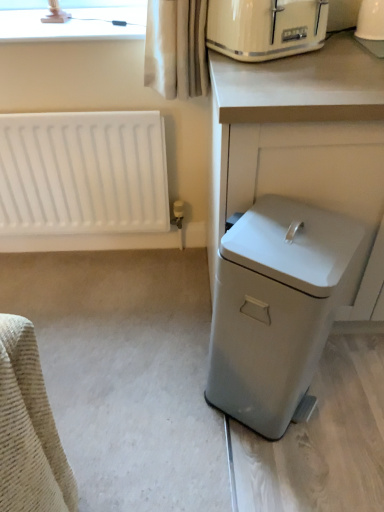
What do you see at coordinates (275, 308) in the screenshot? The height and width of the screenshot is (512, 384). I see `white matte trash can at lower right` at bounding box center [275, 308].

What are the coordinates of `white matte radiator at left` in the screenshot? It's located at (82, 181).

Locate an element on the screen. This screenshot has height=512, width=384. white plastic trash can at right is located at coordinates (303, 142).

You are a GUI agent. You are given a task and a screenshot of the screen. Output one action in this format:
    pyautogui.click(x=<x>, y=<y>)
    Task: Click on the white matte trash can at lower right
    
    Given the screenshot: What is the action you would take?
    pyautogui.click(x=275, y=308)

This screenshot has width=384, height=512. I want to click on dish washer in front of the matte cream toaster at upper right, so (275, 308).

Who is taller, matte cream toaster at upper right or white matte trash can at lower right?

white matte trash can at lower right.

Does matte cream toaster at upper right have a larger size compared to white matte trash can at lower right?

Actually, matte cream toaster at upper right might be smaller than white matte trash can at lower right.

What's the angular difference between white matte trash can at lower right and matte white lampshade at upper left's facing directions?

They differ by 30.1 degrees in their facing directions.

Which of these two, white matte trash can at lower right or matte white lampshade at upper left, is wider?

Wider between the two is matte white lampshade at upper left.

Is white matte trash can at lower right behind matte white lampshade at upper left?

No, white matte trash can at lower right is in front of matte white lampshade at upper left.

Find the location of `bay window that is behind the white matte trash can at lower right`. bay window that is behind the white matte trash can at lower right is located at coordinates (73, 20).

Does point (256, 293) appear closer or farther from the camera than point (294, 17)?

Clearly, point (256, 293) is closer to the camera than point (294, 17).

Identify the location of dish washer below the matte cream toaster at upper right (from a real-world perspective). The width and height of the screenshot is (384, 512). (275, 308).

Are white matte trash can at lower right and matte cream toaster at upper right making contact?

No, white matte trash can at lower right is not with matte cream toaster at upper right.

From a real-world perspective, between white matte trash can at lower right and matte cream toaster at upper right, who is vertically higher?

matte cream toaster at upper right, from a real-world perspective.

Which of these two, white plastic trash can at right or matte white lampshade at upper left, is smaller?

matte white lampshade at upper left.

Identify the location of counter on the right of matte white lampshade at upper left. This screenshot has height=512, width=384. (303, 142).

Can you see white plastic trash can at right touching matte white lampshade at upper left?

white plastic trash can at right and matte white lampshade at upper left are not in contact.

Between white plastic trash can at right and matte white lampshade at upper left, which one has larger width?

white plastic trash can at right is wider.

Is white glossy coffee maker at upper right facing towards white plastic trash can at right?

No, white glossy coffee maker at upper right does not turn towards white plastic trash can at right.

From a real-world perspective, which object stands above the other?

white glossy coffee maker at upper right is physically above.

From the image's perspective, which is below, white glossy coffee maker at upper right or white plastic trash can at right?

white plastic trash can at right, from the image's perspective.

From a real-world perspective, which object stands above the other?

white glossy coffee maker at upper right.

Which of these two, white matte trash can at lower right or white glossy coffee maker at upper right, is bigger?

With larger size is white matte trash can at lower right.

In the scene shown: From the image's perspective, which one is positioned lower, white matte trash can at lower right or white glossy coffee maker at upper right?

white matte trash can at lower right, from the image's perspective.

Find the location of a particular element. bay window above the matte cream toaster at upper right (from the image's perspective) is located at coordinates (73, 20).

Is matte cream toaster at upper right far away from matte white lampshade at upper left?

No, matte cream toaster at upper right is not far from matte white lampshade at upper left.

Between point (304, 25) and point (133, 36), which one is positioned in front?

The point (304, 25) is in front.

Considering the relative positions of matte cream toaster at upper right and matte white lampshade at upper left in the image provided, is matte cream toaster at upper right to the left of matte white lampshade at upper left from the viewer's perspective?

No.

Identify the location of home appliance that is above the white matte trash can at lower right (from a real-world perspective). (266, 28).

You are a GUI agent. You are given a task and a screenshot of the screen. Output one action in this format:
    pyautogui.click(x=<x>, y=<y>)
    Task: Click on the bay window above the white matte trash can at lower right (from the image's perspective)
    Image resolution: width=384 pixels, height=512 pixels.
    Given the screenshot: What is the action you would take?
    pyautogui.click(x=73, y=20)

When comparing their distances from white matte radiator at left, does white matte trash can at lower right or white plastic trash can at right seem closer?

white plastic trash can at right.

Based on their spatial positions, is matte white lampshade at upper left or white matte trash can at lower right further from white matte radiator at left?

white matte trash can at lower right is further to white matte radiator at left.

In the scene shown: Estimate the real-world distances between objects in this image. Which object is closer to white matte radiator at left, white plastic trash can at right or matte white lampshade at upper left?

Among the two, matte white lampshade at upper left is located nearer to white matte radiator at left.

Considering their positions, is matte cream toaster at upper right positioned closer to white plastic trash can at right than white matte trash can at lower right?

matte cream toaster at upper right is positioned closer to the anchor white plastic trash can at right.

From the image, which object appears to be nearer to white matte trash can at lower right, white plastic trash can at right or matte white lampshade at upper left?

white plastic trash can at right lies closer to white matte trash can at lower right than the other object.

Based on their spatial positions, is white matte trash can at lower right or matte white lampshade at upper left further from white plastic trash can at right?

matte white lampshade at upper left is positioned further to the anchor white plastic trash can at right.

In the scene shown: Looking at the image, which one is located closer to matte white lampshade at upper left, matte cream toaster at upper right or white matte trash can at lower right?

The object closer to matte white lampshade at upper left is matte cream toaster at upper right.

Which object lies nearer to the anchor point white matte radiator at left, white plastic trash can at right or matte cream toaster at upper right?

The object closer to white matte radiator at left is matte cream toaster at upper right.

Find the location of a particular element. home appliance that lies between white glossy coffee maker at upper right and white matte trash can at lower right from top to bottom is located at coordinates (266, 28).

You are a GUI agent. You are given a task and a screenshot of the screen. Output one action in this format:
    pyautogui.click(x=<x>, y=<y>)
    Task: Click on the home appliance located between matte white lampshade at upper left and white plastic trash can at right in the left-right direction
    This screenshot has width=384, height=512.
    Given the screenshot: What is the action you would take?
    pyautogui.click(x=266, y=28)

Locate an element on the screen. Image resolution: width=384 pixels, height=512 pixels. counter between matte white lampshade at upper left and white glossy coffee maker at upper right is located at coordinates (303, 142).

I want to click on bay window between white matte radiator at left and white plastic trash can at right from left to right, so (x=73, y=20).